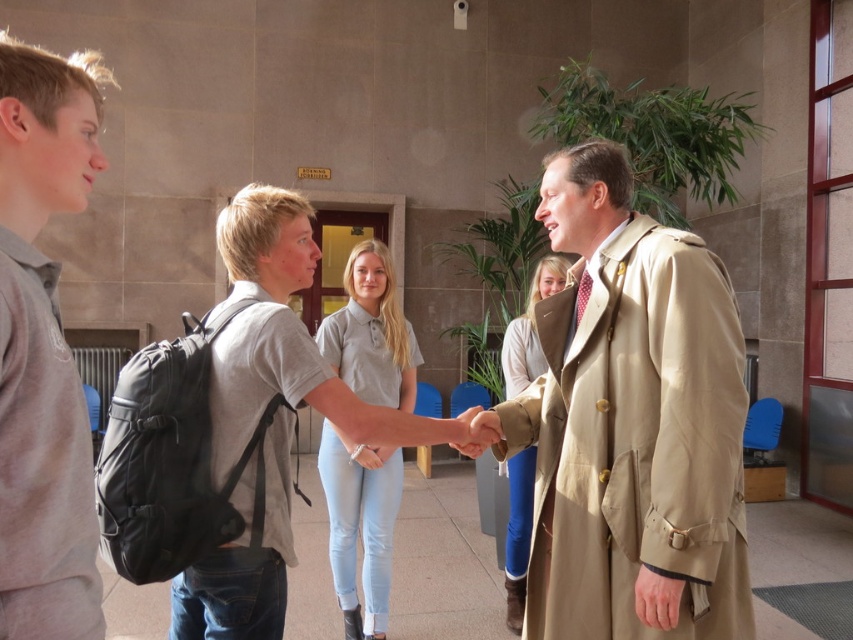
Is gray matte shirt at left shorter than light gray cotton t-shirt at center?

Yes.

Which is behind, point (20, 212) or point (303, 216)?

The point (303, 216) is behind.

In order to click on gray matte shirt at left in this screenshot , I will do `click(44, 348)`.

Can you confirm if gray cotton polo shirt at center is positioned below light beige coat at center?

Incorrect, gray cotton polo shirt at center is not positioned below light beige coat at center.

Is gray cotton polo shirt at center thinner than light beige coat at center?

No.

Is point (381, 456) closer to camera compared to point (514, 472)?

Yes, point (381, 456) is closer to viewer.

What are the coordinates of `gray cotton polo shirt at center` in the screenshot? It's located at (360, 525).

Does gray matte shirt at left appear over gray cotton polo shirt at center?

Yes.

In the scene shown: Measure the distance from gray matte shirt at left to gray cotton polo shirt at center.

gray matte shirt at left is 2.16 meters from gray cotton polo shirt at center.

Is point (65, 504) closer to camera compared to point (350, 484)?

Yes, it is in front of point (350, 484).

Find the location of a particular element. gray matte shirt at left is located at coordinates (44, 348).